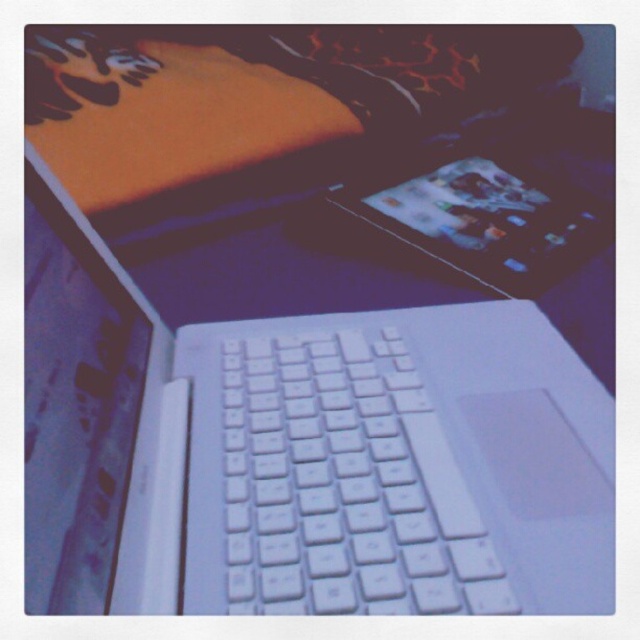
Question: Where is white matte laptop at center located in relation to white plastic keyboard at center in the image?

Choices:
 (A) above
 (B) below

Answer: (A)

Question: Can you confirm if white matte laptop at center is thinner than metallic silver tablet at center?

Choices:
 (A) no
 (B) yes

Answer: (A)

Question: Can you confirm if white matte laptop at center is thinner than white plastic keyboard at center?

Choices:
 (A) yes
 (B) no

Answer: (B)

Question: Which is nearer to the white plastic keyboard at center?

Choices:
 (A) metallic silver tablet at center
 (B) white matte laptop at center

Answer: (B)

Question: Which point is farther from the camera taking this photo?

Choices:
 (A) (406, 177)
 (B) (272, 528)

Answer: (A)

Question: Among these points, which one is farthest from the camera?

Choices:
 (A) (353, 435)
 (B) (220, 596)

Answer: (A)